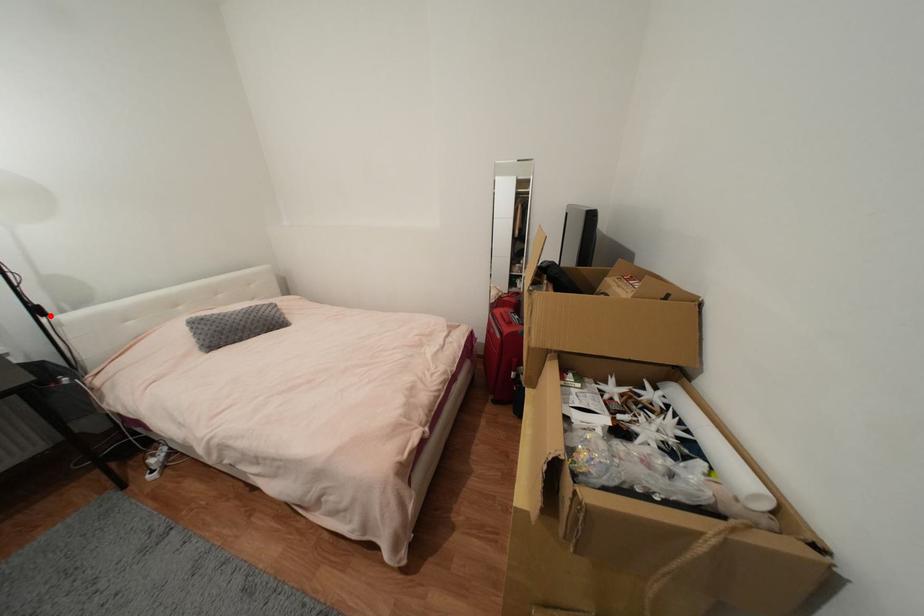
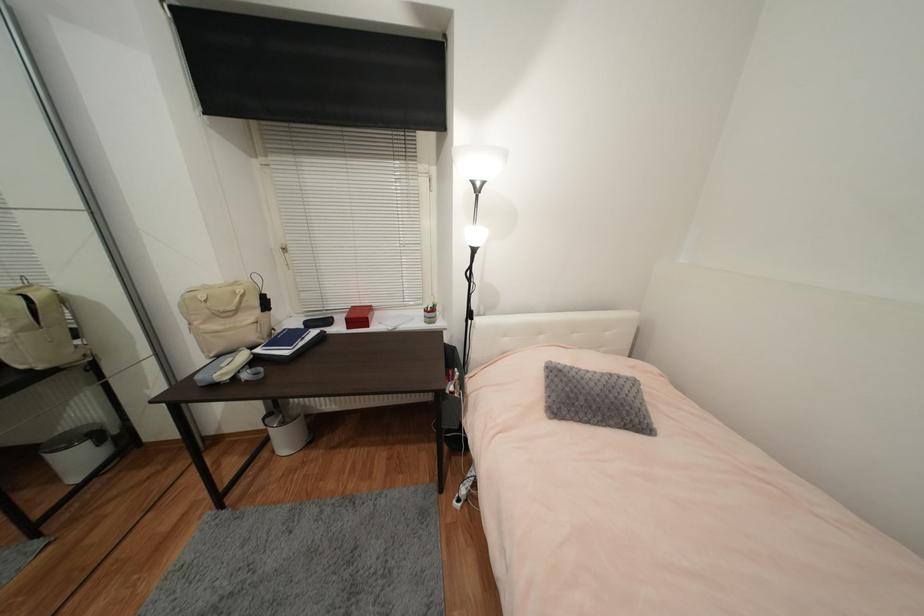
Find the pixel in the second image that matches the highlighted location in the first image.

(477, 320)